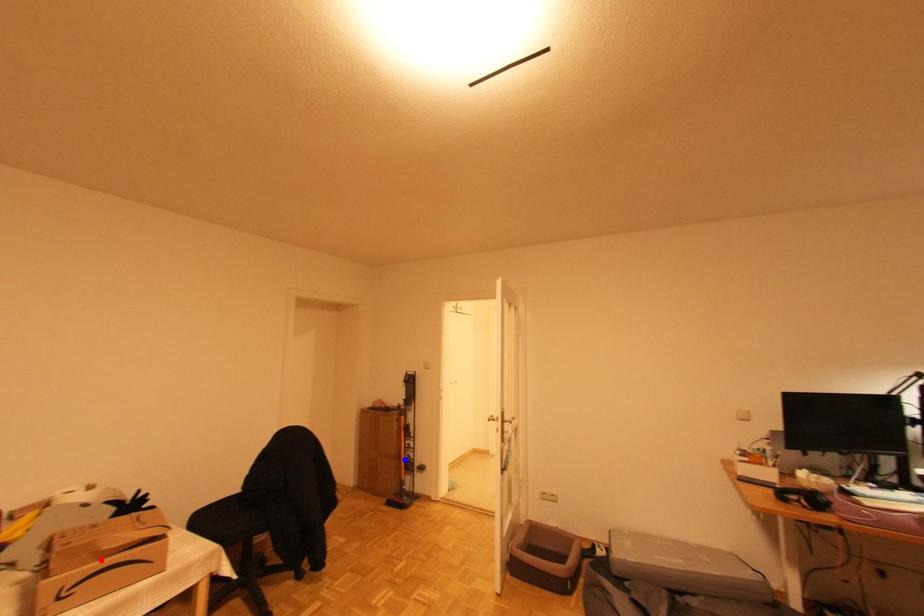
Question: In the image, two points are highlighted. Which point is nearer to the camera? Reply with the corresponding letter.

Choices:
 (A) blue point
 (B) red point

Answer: (B)